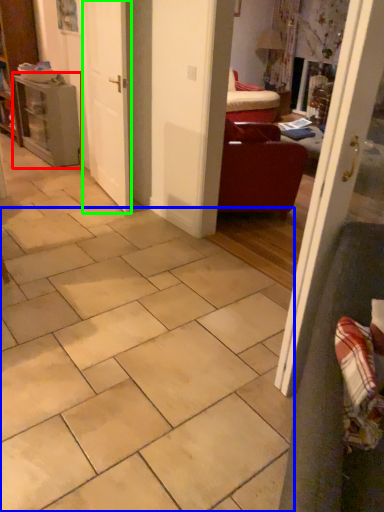
Question: Based on their relative distances, which object is farther from table (highlighted by a red box)? Choose from ceramic tile (highlighted by a blue box) and door (highlighted by a green box).

Choices:
 (A) ceramic tile
 (B) door

Answer: (A)